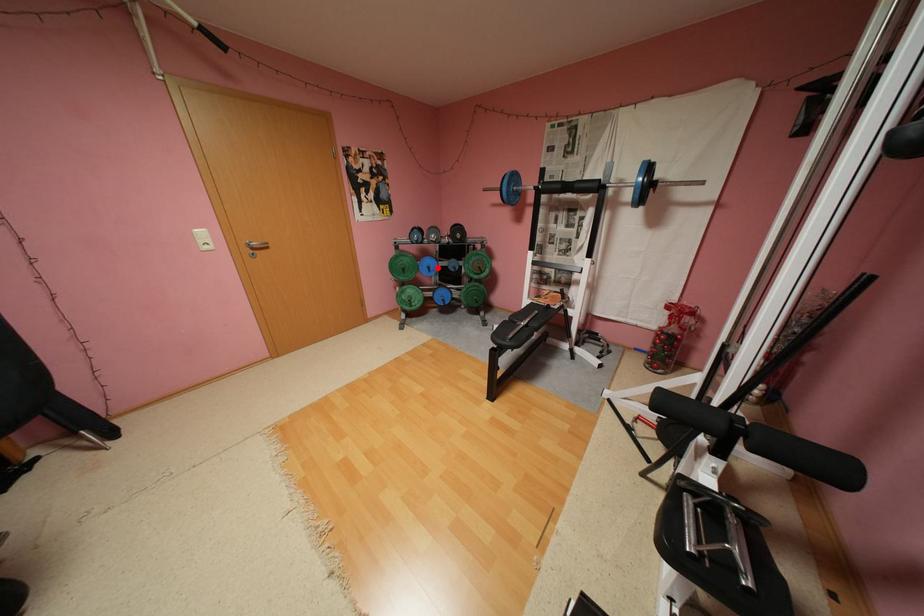
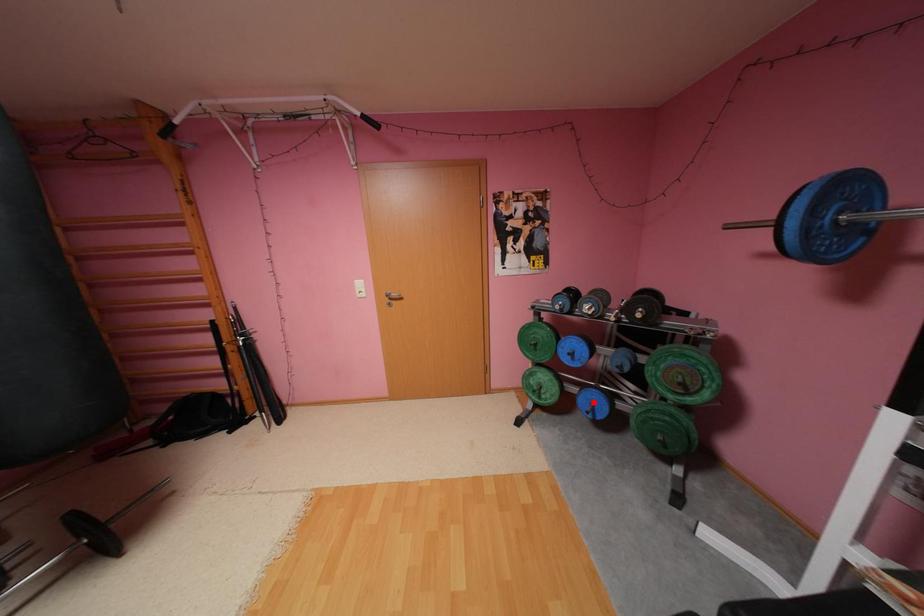
I am providing you with two images of the same scene from different viewpoints. A red point is marked on the first image and another point is marked on the second image. Is the marked point in image1 the same physical position as the marked point in image2?

No